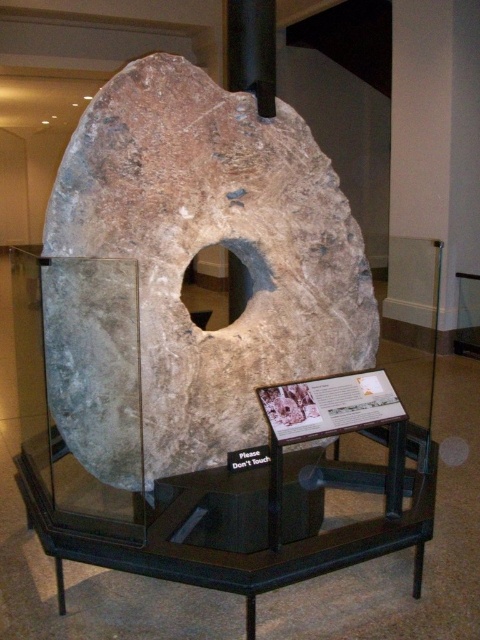
This screenshot has width=480, height=640. I want to click on speckled stone disk at center, so click(213, 243).

Is speckled stone disk at center above brown rough stone hole at center?

Actually, speckled stone disk at center is below brown rough stone hole at center.

This screenshot has height=640, width=480. I want to click on speckled stone disk at center, so click(213, 243).